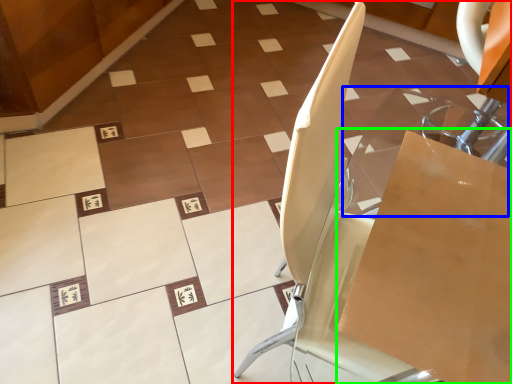
Question: Which is farther away from furniture (highlighted by a red box)? glass table (highlighted by a blue box) or cardboard box (highlighted by a green box)?

Choices:
 (A) glass table
 (B) cardboard box

Answer: (A)